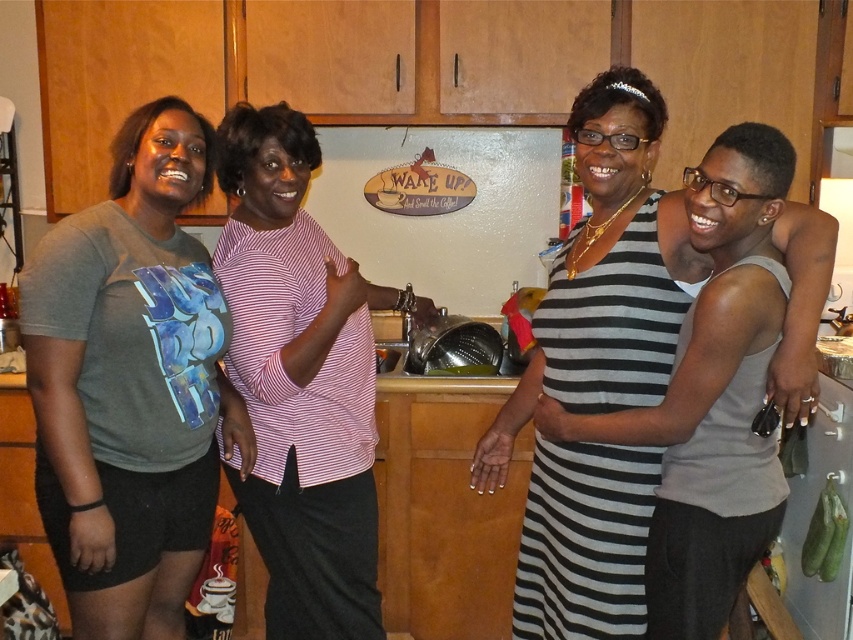
Is black and white striped dress at center wider than pink striped shirt at center?

Indeed, black and white striped dress at center has a greater width compared to pink striped shirt at center.

Which is more to the right, black and white striped dress at center or pink striped shirt at center?

black and white striped dress at center

Who is more distant from viewer, (636,128) or (358,380)?

The point (358,380) is more distant.

Locate an element on the screen. This screenshot has height=640, width=853. black and white striped dress at center is located at coordinates (606, 275).

Between matte gray t-shirt at left and pink striped shirt at center, which one is positioned lower?

Positioned lower is matte gray t-shirt at left.

Is point (164, 234) farther from camera compared to point (314, 486)?

No.

Does point (125, 451) lie behind point (297, 340)?

No, (125, 451) is closer to viewer.

You are a GUI agent. You are given a task and a screenshot of the screen. Output one action in this format:
    pyautogui.click(x=<x>, y=<y>)
    Task: Click on the matte gray t-shirt at left
    
    Given the screenshot: What is the action you would take?
    pyautogui.click(x=131, y=384)

Between matte gray t-shirt at left and black and white striped dress at center, which one has less height?

black and white striped dress at center is shorter.

Does point (154, 376) lie in front of point (630, 541)?

No, (154, 376) is further to viewer.

Is point (194, 536) positioned behind point (573, 380)?

Yes.

Identify the location of matte gray t-shirt at left. (131, 384).